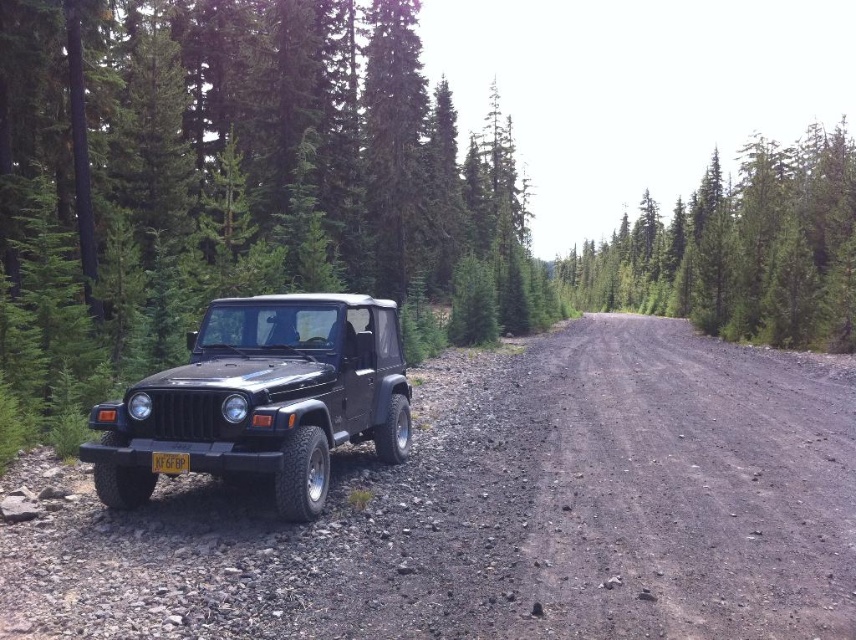
Does dirt/gravel road at center appear on the right side of yellow matte license plate at center?

Correct, you'll find dirt/gravel road at center to the right of yellow matte license plate at center.

Is dirt/gravel road at center to the left of yellow matte license plate at center from the viewer's perspective?

Incorrect, dirt/gravel road at center is not on the left side of yellow matte license plate at center.

Between point (563, 484) and point (187, 470), which one is positioned in front?

Positioned in front is point (187, 470).

The image size is (856, 640). Find the location of `dirt/gravel road at center`. dirt/gravel road at center is located at coordinates (498, 513).

Is point (712, 540) closer to viewer compared to point (296, 433)?

Yes, point (712, 540) is in front of point (296, 433).

Is dusty gravel road at center closer to camera compared to matte black jeep at left?

Yes, it is.

Where is `dusty gravel road at center`? dusty gravel road at center is located at coordinates (688, 490).

Which is behind, point (57, 516) or point (110, 428)?

Point (57, 516)

Is dirt/gravel road at center positioned at the back of matte black jeep at left?

No, dirt/gravel road at center is closer to the viewer.

Where is `dirt/gravel road at center`? This screenshot has height=640, width=856. dirt/gravel road at center is located at coordinates point(498,513).